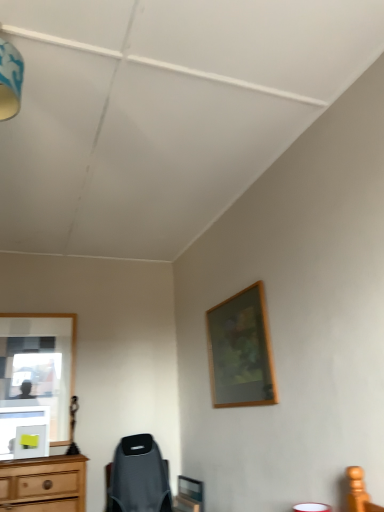
Question: Considering their positions, is blue fabric lampshade at upper left located in front of or behind wooden picture frame at upper right?

Choices:
 (A) behind
 (B) front

Answer: (B)

Question: Is blue fabric lampshade at upper left wider or thinner than wooden picture frame at upper right?

Choices:
 (A) wide
 (B) thin

Answer: (A)

Question: Considering the relative positions of blue fabric lampshade at upper left and wooden picture frame at upper right in the image provided, is blue fabric lampshade at upper left to the left or to the right of wooden picture frame at upper right?

Choices:
 (A) right
 (B) left

Answer: (B)

Question: From the image's perspective, relative to blue fabric lampshade at upper left, is wooden picture frame at upper right above or below?

Choices:
 (A) below
 (B) above

Answer: (A)

Question: Is wooden picture frame at upper right taller or shorter than blue fabric lampshade at upper left?

Choices:
 (A) short
 (B) tall

Answer: (B)

Question: Is point (248, 303) positioned closer to the camera than point (16, 93)?

Choices:
 (A) farther
 (B) closer

Answer: (A)

Question: Relative to blue fabric lampshade at upper left, is wooden picture frame at upper right in front or behind?

Choices:
 (A) behind
 (B) front

Answer: (A)